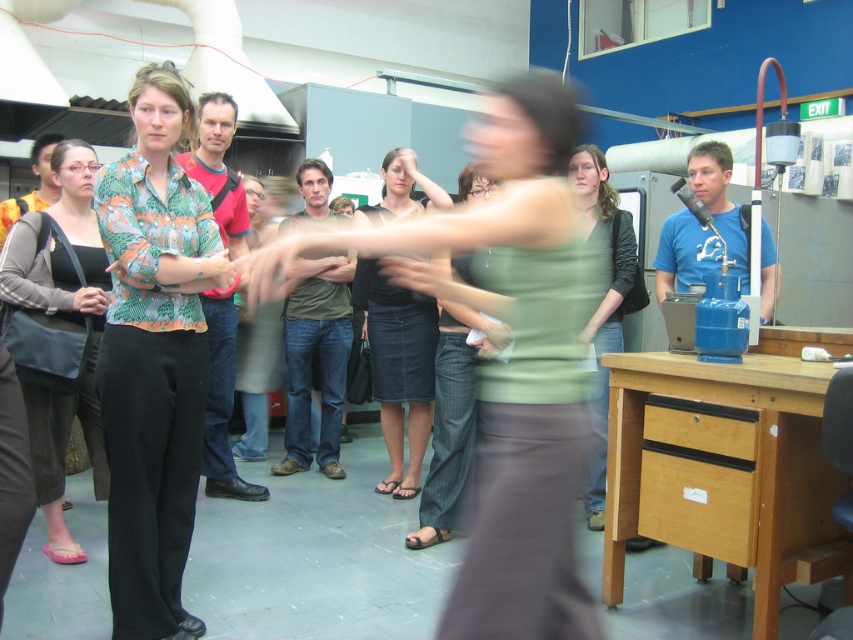
You are a person who is 1.7 meters tall. You want to reach a point located at point (550, 147). Can you reach it?

The point (550, 147) is 1.68 meters away from you, so yes, you can reach it since you are 1.7 meters tall and the distance is within your reach.

From the picture: In the workshop scene, there are two people wearing tank tops at the center. The first person is wearing a green matte tank top at center, and the second is wearing a matte black tank top at center. From the perspective of someone standing in front of the group, which tank top is positioned to the left?

The matte black tank top at center is positioned to the left because the green matte tank top at center is to its right.